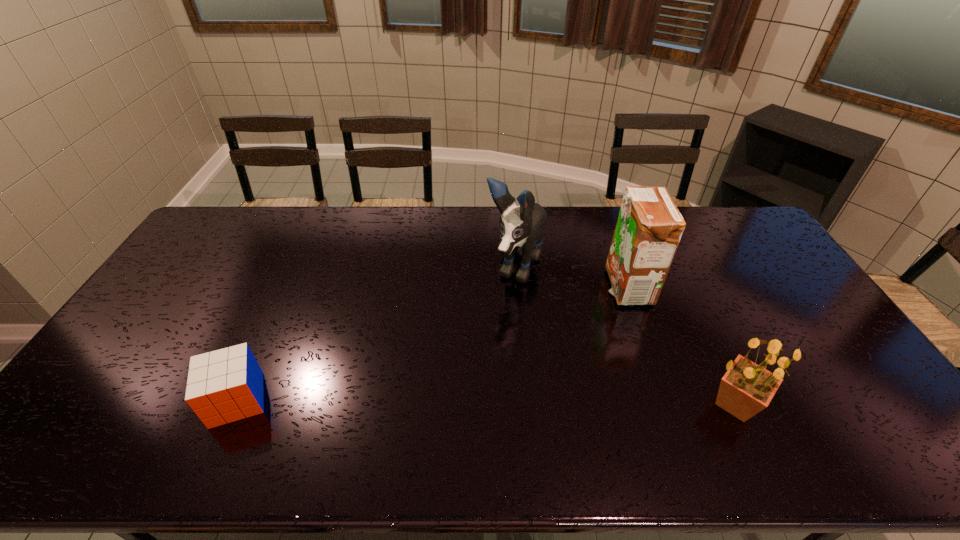
You are a GUI agent. You are given a task and a screenshot of the screen. Output one action in this format:
    pyautogui.click(x=<x>, y=<y>)
    Task: Click on the free space on the desktop that is between the cube and the third tallest object and is positioned on the straw side of the third shortest object
    The image size is (960, 540).
    Given the screenshot: What is the action you would take?
    pyautogui.click(x=480, y=402)

The height and width of the screenshot is (540, 960). In order to click on free space on the desktop that is between the shortest object and the second shortest object and is positioned on the front-facing side of the puppy in this screenshot , I will do `click(435, 401)`.